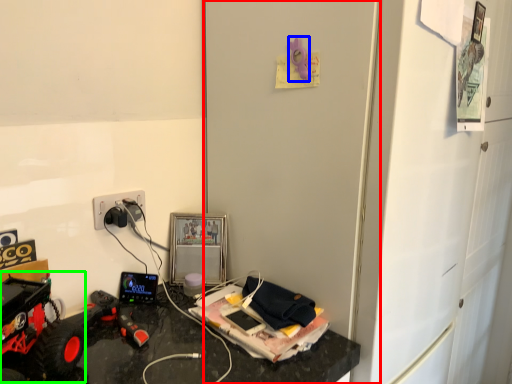
Question: Considering the real-world distances, which object is farthest from door (highlighted by a red box)? toy (highlighted by a blue box) or toy car (highlighted by a green box)?

Choices:
 (A) toy
 (B) toy car

Answer: (B)